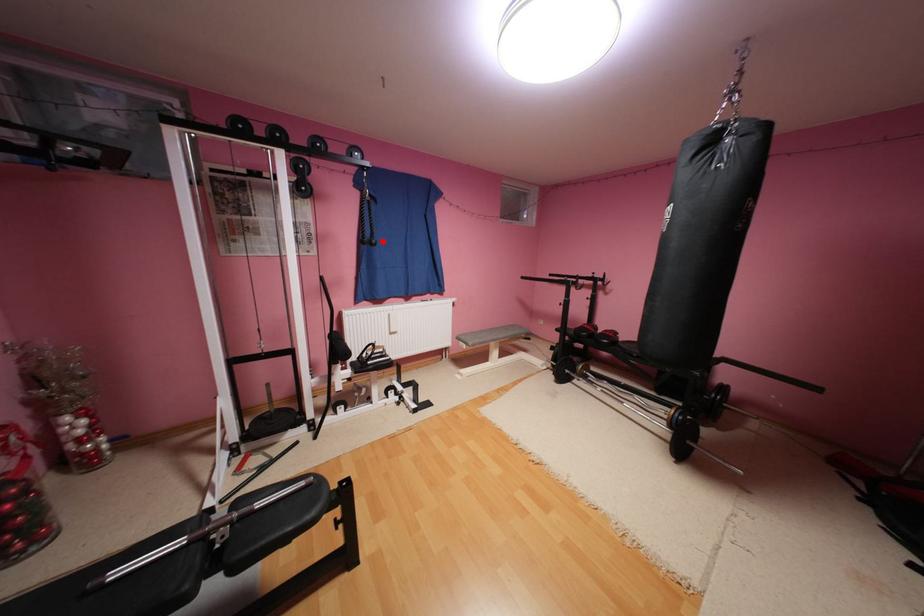
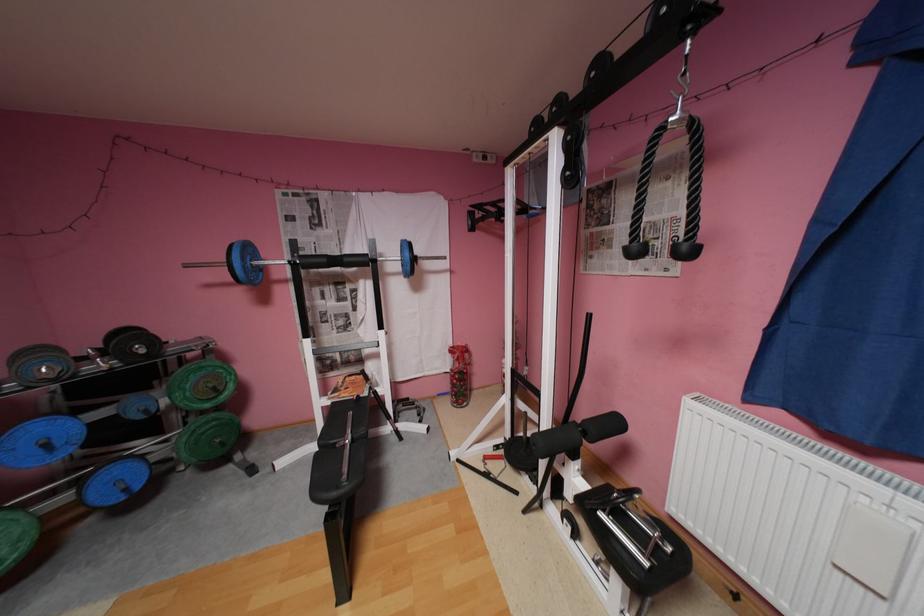
The point at the highlighted location is marked in the first image. Where is the corresponding point in the second image?

(695, 246)